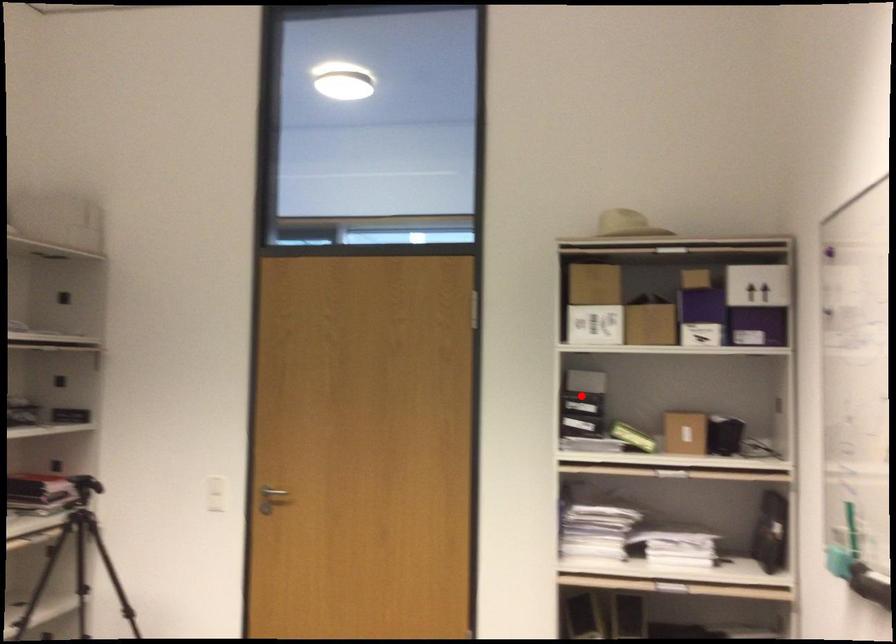
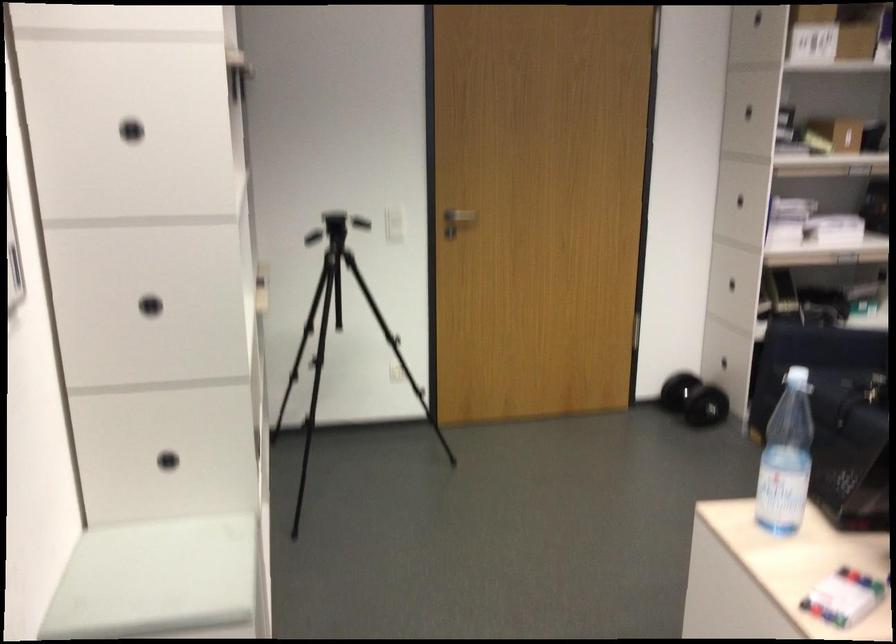
Question: A red point is marked in image1. In image2, is the corresponding 3D point closer to the camera or farther? Reply with the corresponding letter.

Choices:
 (A) The corresponding 3D point is closer.
 (B) The corresponding 3D point is farther.

Answer: (B)